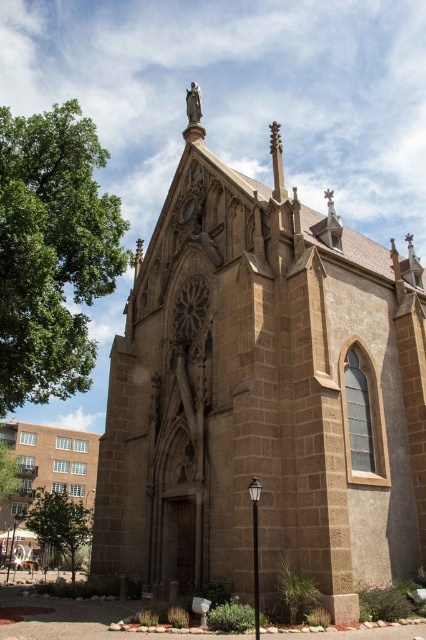
You are an architect planning to build a new Gothic church. You have two design options based on the image provided. The first design is the brown stone church at center, and the second is the brown stone church at lower left. If you want a church that occupies more horizontal space, which design should you choose?

The brown stone church at center might be wider than brown stone church at lower left, so choosing the brown stone church at center would provide a design that occupies more horizontal space.

You are standing in front of the brown stone church at center and want to take a photo of the green leafy tree at lower left. Since the tree is partially hidden by the church, can you still see the tree from your current position?

The brown stone church at center is closer to the viewer than the green leafy tree at lower left, so yes, you can still see the green leafy tree at lower left from your current position because it is not directly behind the church but positioned at a lower left angle.